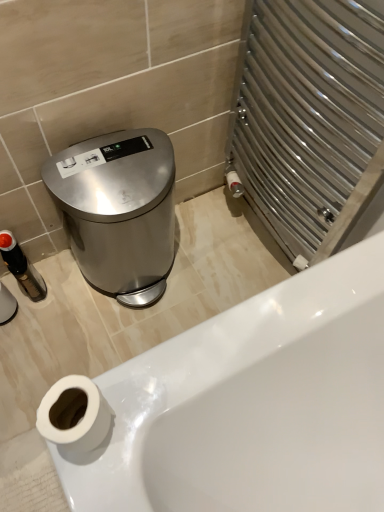
Question: From a real-world perspective, is white matte toilet paper at lower left located beneath white glossy bathtub at lower left?

Choices:
 (A) yes
 (B) no

Answer: (B)

Question: From a real-world perspective, does white matte toilet paper at lower left stand above white glossy bathtub at lower left?

Choices:
 (A) yes
 (B) no

Answer: (A)

Question: Is white matte toilet paper at lower left directly adjacent to white glossy bathtub at lower left?

Choices:
 (A) yes
 (B) no

Answer: (B)

Question: Is white matte toilet paper at lower left not near white glossy bathtub at lower left?

Choices:
 (A) yes
 (B) no

Answer: (B)

Question: Could white glossy bathtub at lower left be considered to be inside white matte toilet paper at lower left?

Choices:
 (A) yes
 (B) no

Answer: (B)

Question: Considering the positions of polished stainless steel trash can at left and white matte toilet paper at lower left in the image, is polished stainless steel trash can at left bigger or smaller than white matte toilet paper at lower left?

Choices:
 (A) big
 (B) small

Answer: (A)

Question: Considering the positions of polished stainless steel trash can at left and white matte toilet paper at lower left in the image, is polished stainless steel trash can at left taller or shorter than white matte toilet paper at lower left?

Choices:
 (A) short
 (B) tall

Answer: (B)

Question: Is polished stainless steel trash can at left wider or thinner than white matte toilet paper at lower left?

Choices:
 (A) thin
 (B) wide

Answer: (B)

Question: From the image's perspective, is polished stainless steel trash can at left above or below white matte toilet paper at lower left?

Choices:
 (A) below
 (B) above

Answer: (B)

Question: Do you think white glossy bathtub at lower left is within white matte toilet paper at lower left, or outside of it?

Choices:
 (A) outside
 (B) inside

Answer: (A)

Question: From their relative heights in the image, would you say white glossy bathtub at lower left is taller or shorter than white matte toilet paper at lower left?

Choices:
 (A) tall
 (B) short

Answer: (B)

Question: In terms of width, does white glossy bathtub at lower left look wider or thinner when compared to white matte toilet paper at lower left?

Choices:
 (A) thin
 (B) wide

Answer: (B)

Question: Is point (340, 354) closer or farther from the camera than point (66, 408)?

Choices:
 (A) closer
 (B) farther

Answer: (B)

Question: Is white matte toilet paper at lower left spatially inside white glossy bathtub at lower left, or outside of it?

Choices:
 (A) inside
 (B) outside

Answer: (B)

Question: In terms of width, does white matte toilet paper at lower left look wider or thinner when compared to white glossy bathtub at lower left?

Choices:
 (A) wide
 (B) thin

Answer: (B)